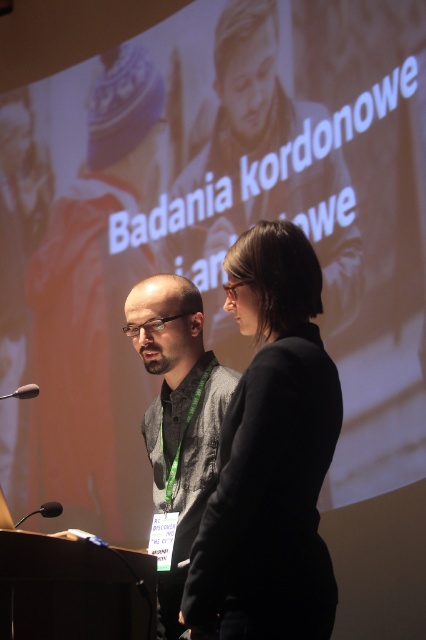
Question: Among these objects, which one is nearest to the camera?

Choices:
 (A) black matte microphone at lower left
 (B) black fabric jacket at center
 (C) dark gray textured shirt at center

Answer: (B)

Question: Can you confirm if dark gray textured shirt at center is positioned to the left of matte black microphone at lower left?

Choices:
 (A) yes
 (B) no

Answer: (B)

Question: Does black fabric jacket at center come behind dark gray textured shirt at center?

Choices:
 (A) yes
 (B) no

Answer: (B)

Question: Is black fabric jacket at center wider than dark gray textured shirt at center?

Choices:
 (A) yes
 (B) no

Answer: (B)

Question: Among these points, which one is nearest to the camera?

Choices:
 (A) (146, 289)
 (B) (299, 294)
 (C) (34, 509)
 (D) (39, 390)

Answer: (B)

Question: Among these points, which one is farthest from the camera?

Choices:
 (A) (215, 396)
 (B) (307, 556)
 (C) (42, 506)

Answer: (C)